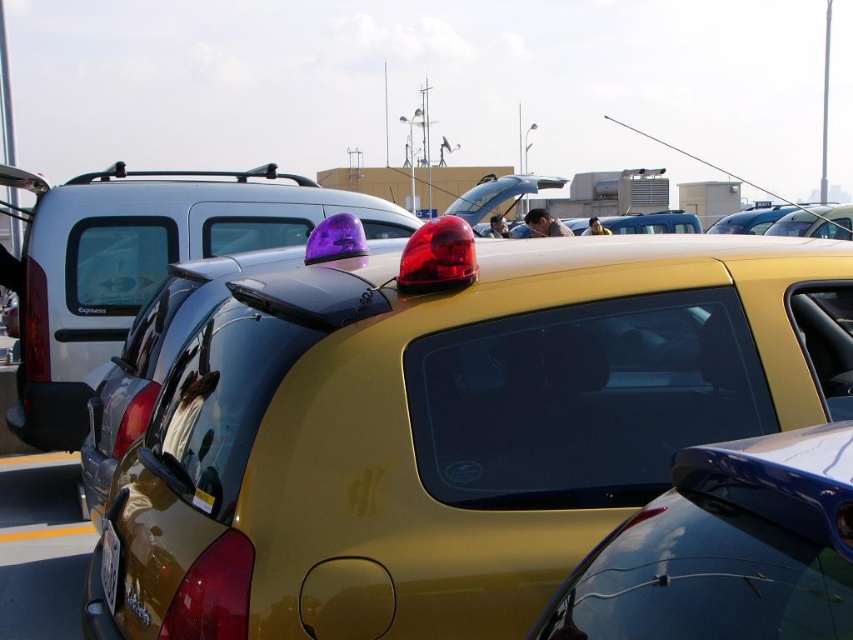
Question: Among these points, which one is nearest to the camera?

Choices:
 (A) (28, 532)
 (B) (119, 568)

Answer: (B)

Question: Among these points, which one is farthest from the camera?

Choices:
 (A) (59, 525)
 (B) (814, 502)
 (C) (102, 552)

Answer: (A)

Question: Does metallic yellow taxi at center have a smaller size compared to yellow plastic license plate at lower center?

Choices:
 (A) no
 (B) yes

Answer: (A)

Question: Does metallic yellow taxi at center come behind yellow plastic license plate at lower center?

Choices:
 (A) no
 (B) yes

Answer: (A)

Question: Considering the relative positions of yellow plastic license plate at lower center and black glossy line at lower left in the image provided, where is yellow plastic license plate at lower center located with respect to black glossy line at lower left?

Choices:
 (A) above
 (B) below

Answer: (A)

Question: Which of the following is the closest to the observer?

Choices:
 (A) yellow matte line at lower center
 (B) glossy blue spoiler at upper right

Answer: (B)